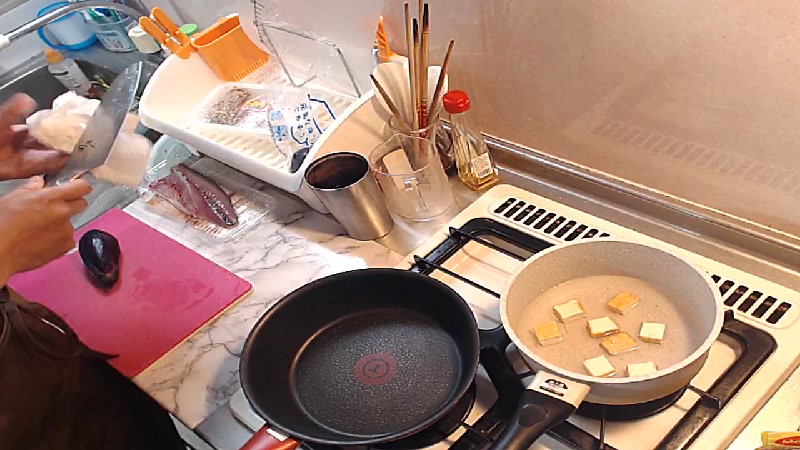
The width and height of the screenshot is (800, 450). Find the location of `black pan`. black pan is located at coordinates (430, 377).